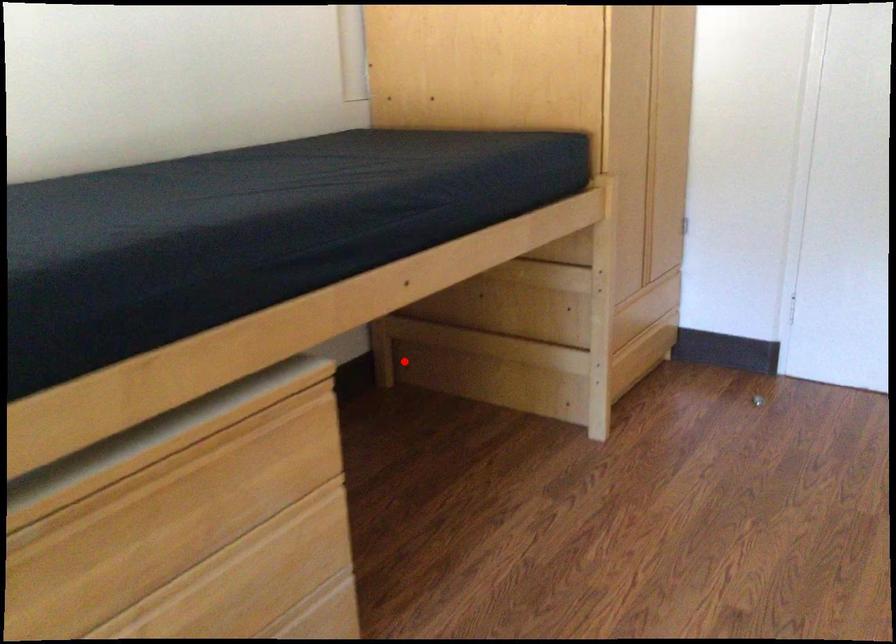
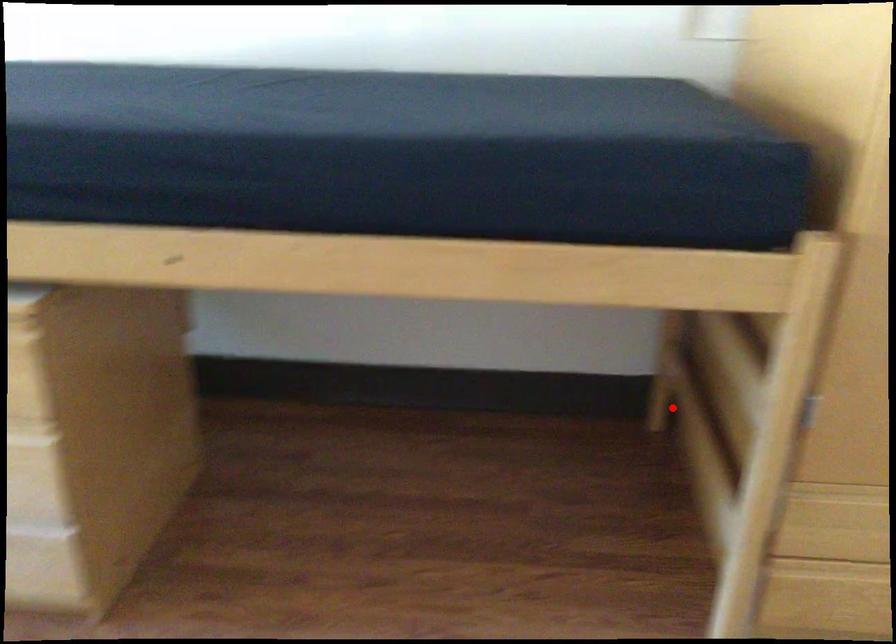
I am providing you with two images of the same scene from different viewpoints. A red point is marked on the first image and another point is marked on the second image. Do the highlighted points in image1 and image2 indicate the same real-world spot?

Yes